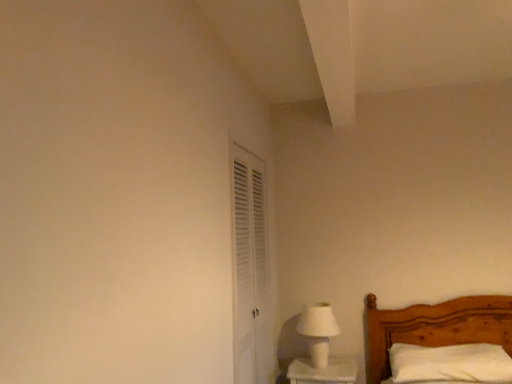
Question: Can you confirm if white louvered door at center-left is wider than white matte table lamp at lower right?

Choices:
 (A) no
 (B) yes

Answer: (A)

Question: Would you say white louvered door at center-left contains white matte table lamp at lower right?

Choices:
 (A) yes
 (B) no

Answer: (B)

Question: From a real-world perspective, is white louvered door at center-left positioned under white matte table lamp at lower right based on gravity?

Choices:
 (A) no
 (B) yes

Answer: (A)

Question: Does white louvered door at center-left have a lesser height compared to white matte table lamp at lower right?

Choices:
 (A) no
 (B) yes

Answer: (A)

Question: Is white louvered door at center-left not near white matte table lamp at lower right?

Choices:
 (A) no
 (B) yes

Answer: (A)

Question: From the image's perspective, does white louvered door at center-left appear lower than white matte table lamp at lower right?

Choices:
 (A) yes
 (B) no

Answer: (B)

Question: Is white matte table lamp at lower right bigger than white soft pillow at lower right?

Choices:
 (A) yes
 (B) no

Answer: (B)

Question: From the image's perspective, is white matte table lamp at lower right located beneath white soft pillow at lower right?

Choices:
 (A) yes
 (B) no

Answer: (B)

Question: Considering the relative sizes of white matte table lamp at lower right and white soft pillow at lower right in the image provided, is white matte table lamp at lower right thinner than white soft pillow at lower right?

Choices:
 (A) yes
 (B) no

Answer: (A)

Question: Is white matte table lamp at lower right shorter than white soft pillow at lower right?

Choices:
 (A) no
 (B) yes

Answer: (A)

Question: Is white matte table lamp at lower right touching white soft pillow at lower right?

Choices:
 (A) yes
 (B) no

Answer: (B)

Question: Can you confirm if white matte table lamp at lower right is positioned to the right of white soft pillow at lower right?

Choices:
 (A) yes
 (B) no

Answer: (B)

Question: Is white soft pillow at lower right to the left of white louvered door at center-left from the viewer's perspective?

Choices:
 (A) yes
 (B) no

Answer: (B)